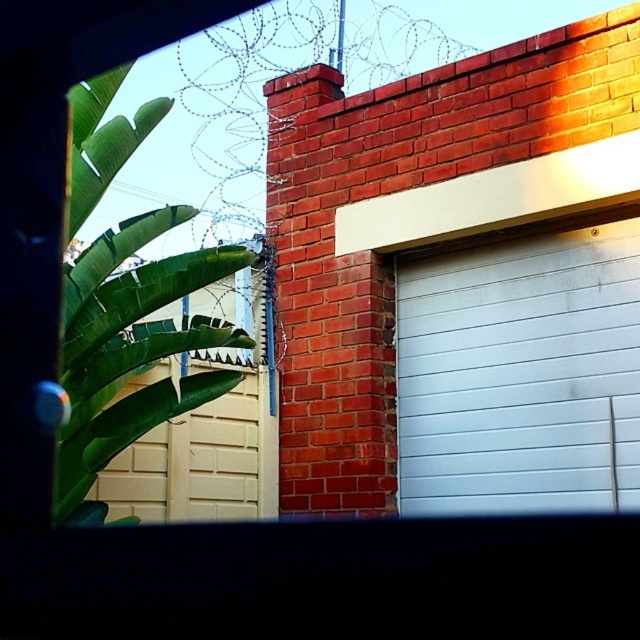
Question: Is green leafy plant at left positioned at the back of beige textured garage door at lower left?

Choices:
 (A) yes
 (B) no

Answer: (B)

Question: Which of the following is the farthest from the observer?

Choices:
 (A) beige textured garage door at lower left
 (B) green leafy plant at left
 (C) white smooth garage door at center

Answer: (A)

Question: Estimate the real-world distances between objects in this image. Which object is farther from the green leafy plant at left?

Choices:
 (A) beige textured garage door at lower left
 (B) white smooth garage door at center

Answer: (B)

Question: Does white smooth garage door at center appear under beige textured garage door at lower left?

Choices:
 (A) yes
 (B) no

Answer: (B)

Question: Among these points, which one is nearest to the camera?

Choices:
 (A) (480, 282)
 (B) (90, 480)

Answer: (B)

Question: Does green leafy plant at left come behind beige textured garage door at lower left?

Choices:
 (A) no
 (B) yes

Answer: (A)